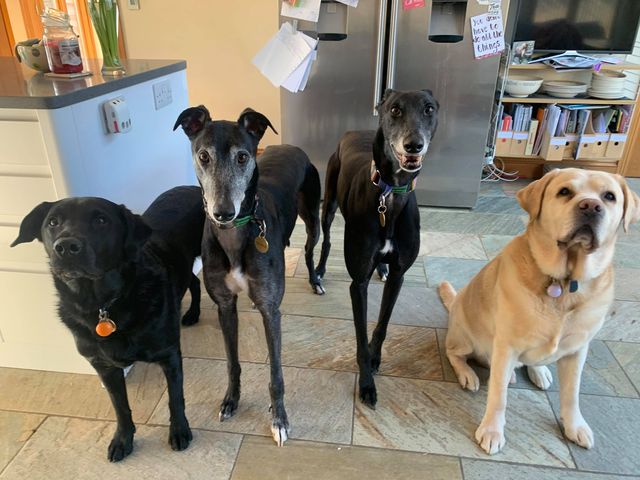
This screenshot has width=640, height=480. Identify the location of outlet. (120, 118).